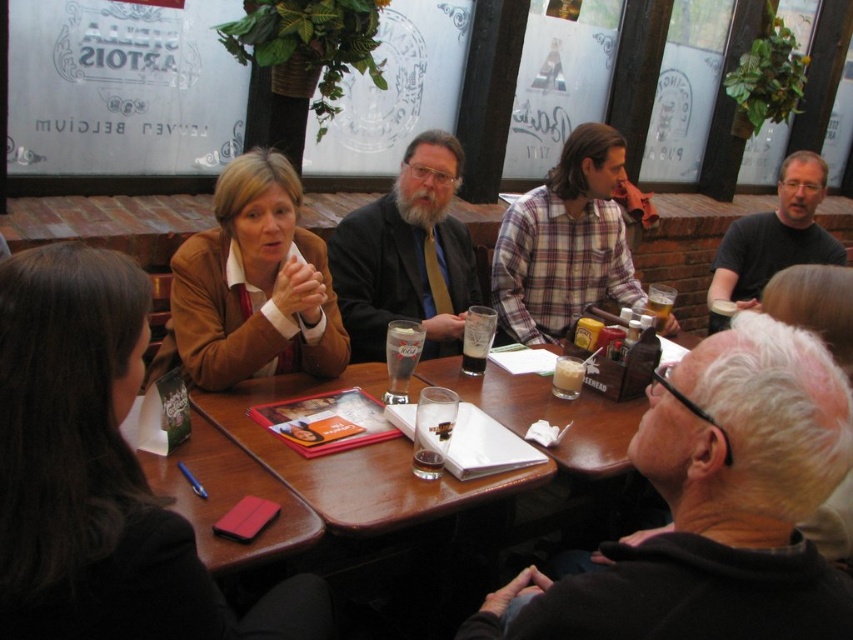
You are a server at the restaurant and need to deliver a drink to the person wearing the matte brown blazer at upper left. The drink is currently placed on the table near the brown leather jacket at center. Can you reach the blazer wearer without moving the jacket wearer?

The matte brown blazer at upper left is located below the brown leather jacket at center, so yes, you can reach the blazer wearer by moving around or under the jacket wearer without disturbing them.

You are a photographer positioned at the center of the room. You want to take a photo of the white matte hair at upper right without including the person sitting at the lower left. Can you adjust your position to achieve this?

The white matte hair at upper right is located at point (717, 506), so you can move to the right side of the room to capture the white matte hair at upper right while avoiding the person at the lower left.

You are a photographer positioned at the center of the room. You want to capture a closeup shot of the white matte hair at upper right without moving the camera. Is it possible to do so while keeping all seven people and the rectangular table in the frame?

Yes, since the white matte hair at upper right is located at point (717, 506), which is within the field of view that includes all seven people and the rectangular table.